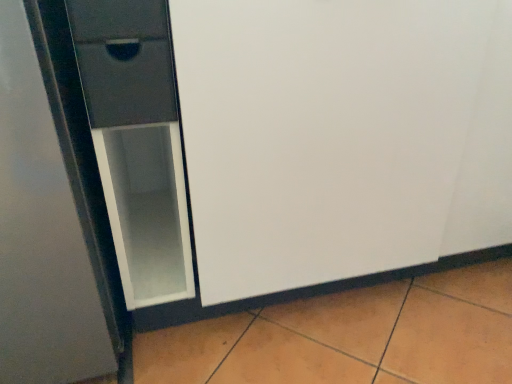
Question: From the image's perspective, relative to matte black drawer at left, which is the 2th drawer from top to bottom, is matte black drawer at upper left, the second drawer from the bottom, above or below?

Choices:
 (A) below
 (B) above

Answer: (B)

Question: From a real-world perspective, is matte black drawer at upper left, the 1th drawer when ordered from top to bottom, above or below matte black drawer at left, which appears as the 1th drawer when ordered from the bottom?

Choices:
 (A) above
 (B) below

Answer: (A)

Question: Considering the real-world distances, which object is closest to the matte black drawer at upper left, the second drawer from the bottom?

Choices:
 (A) matte glass screen door at left
 (B) matte black drawer at left, which is the 2th drawer from top to bottom

Answer: (B)

Question: Which object is positioned closest to the matte black drawer at upper left, the second drawer from the bottom?

Choices:
 (A) matte black drawer at left, which appears as the 1th drawer when ordered from the bottom
 (B) matte glass screen door at left

Answer: (A)